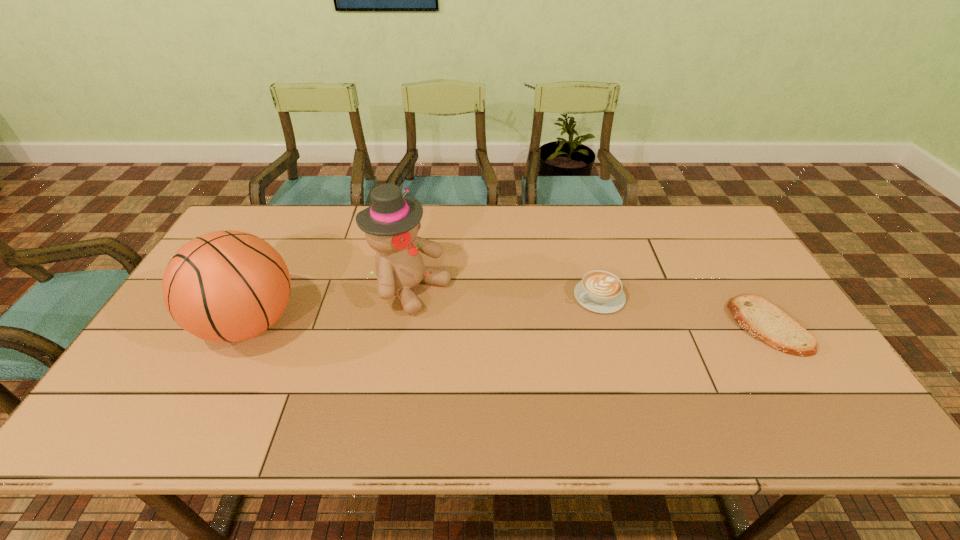
You are a GUI agent. You are given a task and a screenshot of the screen. Output one action in this format:
    pyautogui.click(x=<x>, y=<y>)
    Task: Click on the vacant area situated on the side of the second shortest object with the handle
    
    Given the screenshot: What is the action you would take?
    tap(499, 347)

You are a GUI agent. You are given a task and a screenshot of the screen. Output one action in this format:
    pyautogui.click(x=<x>, y=<y>)
    Task: Click on the blank area located on the front-facing side of the rag_doll
    
    Given the screenshot: What is the action you would take?
    pyautogui.click(x=534, y=346)

Identify the location of free space located 0.140m on the front-facing side of the rag_doll. (487, 324).

The width and height of the screenshot is (960, 540). Find the location of `free space located on the front-facing side of the rag_doll`. free space located on the front-facing side of the rag_doll is located at coordinates pyautogui.click(x=570, y=362).

Identify the location of object positioned at the left edge. click(227, 286).

Where is `object positioned at the right edge`? The width and height of the screenshot is (960, 540). object positioned at the right edge is located at coordinates (764, 321).

The image size is (960, 540). I want to click on free space at the far edge, so click(297, 218).

In the image, there is a desktop. Find the location of `blank space at the near edge`. blank space at the near edge is located at coordinates (473, 383).

Find the location of a particular element. This screenshot has width=960, height=540. vacant space at the right edge of the desktop is located at coordinates (736, 284).

The height and width of the screenshot is (540, 960). What are the coordinates of `free space between the second object from right to left and the third object from right to left` in the screenshot? It's located at (505, 293).